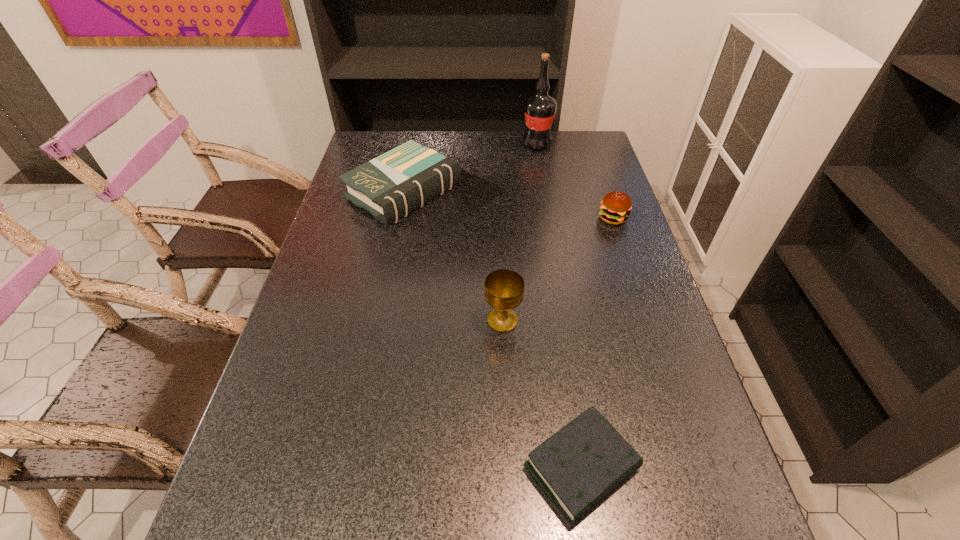
Locate an element on the screen. The width and height of the screenshot is (960, 540). vacant space at the left edge is located at coordinates (293, 458).

In the image, there is a desktop. Identify the location of vacant space at the right edge. (572, 178).

This screenshot has width=960, height=540. In the image, there is a desktop. Find the location of `vacant space at the far left corner`. vacant space at the far left corner is located at coordinates point(377,152).

This screenshot has height=540, width=960. What are the coordinates of `free area in between the farthest object and the shortest object` in the screenshot? It's located at (559, 306).

The width and height of the screenshot is (960, 540). Identify the location of vacant space in between the hamburger and the paperback book. (508, 205).

Where is `free spot between the nearest object and the rightmost object`? Image resolution: width=960 pixels, height=540 pixels. free spot between the nearest object and the rightmost object is located at coordinates (597, 343).

The image size is (960, 540). In order to click on blank region between the hamburger and the nearest object in this screenshot , I will do `click(597, 343)`.

Where is `vacant space that is in between the chalice and the tallest object`? vacant space that is in between the chalice and the tallest object is located at coordinates (519, 232).

The height and width of the screenshot is (540, 960). I want to click on vacant space that's between the nearest object and the rightmost object, so click(x=597, y=343).

Find the location of a particular element. free space between the paperback book and the Bible is located at coordinates (492, 330).